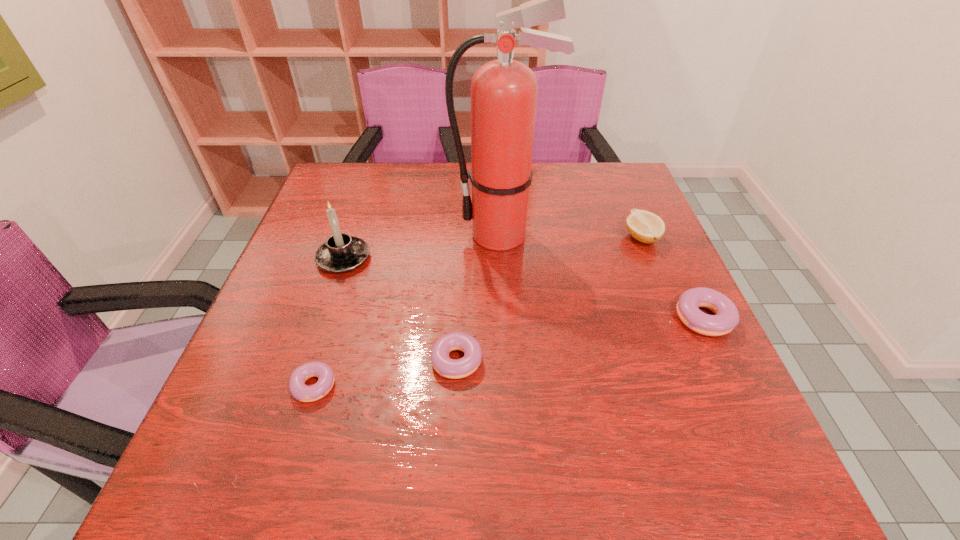
You are a GUI agent. You are given a task and a screenshot of the screen. Output one action in this format:
    pyautogui.click(x=<x>, y=<y>)
    Task: Click on the vacant region between the leftmost doughnut and the fire extinguisher
    
    Given the screenshot: What is the action you would take?
    pyautogui.click(x=408, y=310)

I want to click on blank region between the fourth tallest object and the fifth tallest object, so (x=575, y=340).

Identify the location of vacant area that lies between the farthest doughnut and the second shortest object. Image resolution: width=960 pixels, height=540 pixels. (575, 340).

You are a GUI agent. You are given a task and a screenshot of the screen. Output one action in this format:
    pyautogui.click(x=<x>, y=<y>)
    Task: Click on the free spot between the lemon and the fire extinguisher
    
    Given the screenshot: What is the action you would take?
    pyautogui.click(x=571, y=236)

Find the location of a particular element. The height and width of the screenshot is (540, 960). free space between the farthest doughnut and the leftmost doughnut is located at coordinates (506, 352).

This screenshot has height=540, width=960. Identify the location of vacant region between the fire extinguisher and the fifth tallest object. (477, 298).

Locate an element on the screen. vacant area that lies between the second tallest object and the leftmost doughnut is located at coordinates (329, 322).

In order to click on vacant area that lies between the second tallest object and the tallest object in this screenshot , I will do `click(422, 246)`.

At what (x,y) coordinates should I click in order to perform the action: click on free space between the tallest object and the lemon. Please return your answer as a coordinate pair (x, y). Looking at the image, I should click on tap(571, 236).

This screenshot has width=960, height=540. In order to click on object that can be found as the second closest to the farthest doughnut in this screenshot , I will do `click(504, 91)`.